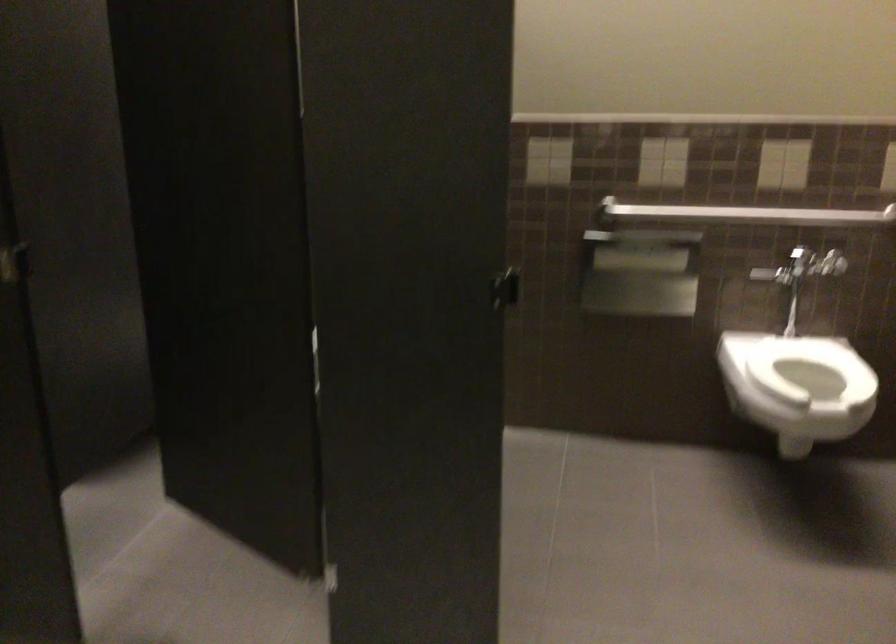
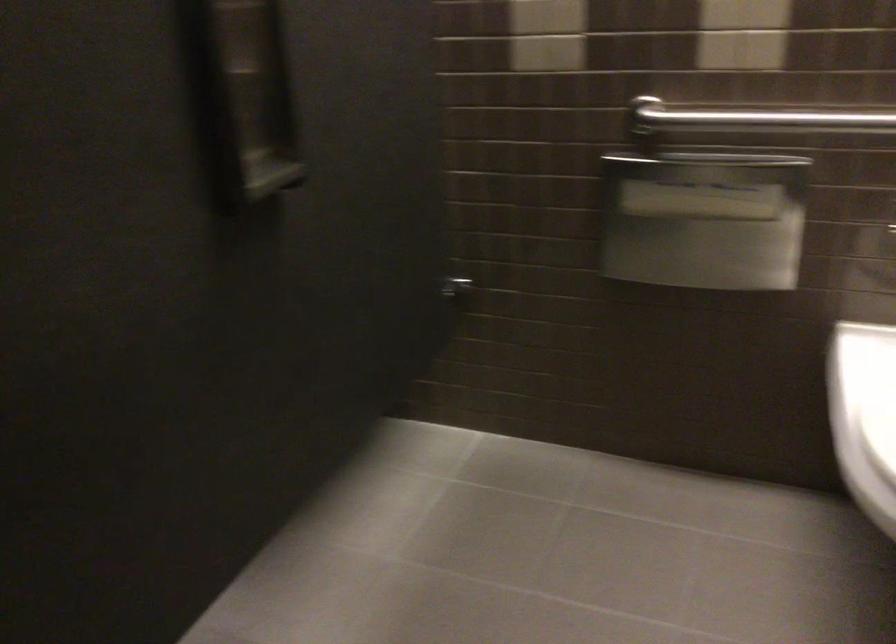
Find the pixel in the second image that matches (677,210) in the first image.

(751, 116)